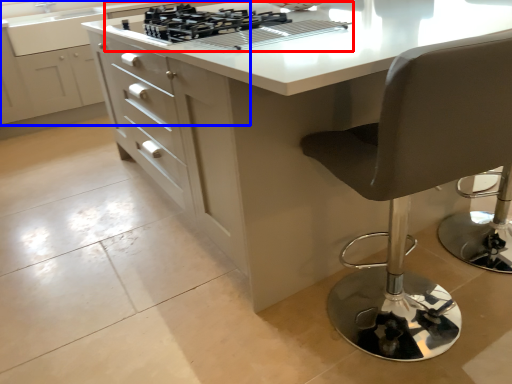
Question: Which of the following is the closest to the observer, gas stove (highlighted by a red box) or cabinetry (highlighted by a blue box)?

Choices:
 (A) gas stove
 (B) cabinetry

Answer: (A)